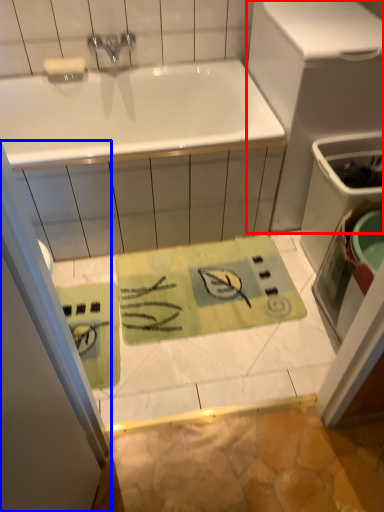
Question: Which object is closer to the camera taking this photo, appliance (highlighted by a red box) or shower door (highlighted by a blue box)?

Choices:
 (A) appliance
 (B) shower door

Answer: (B)